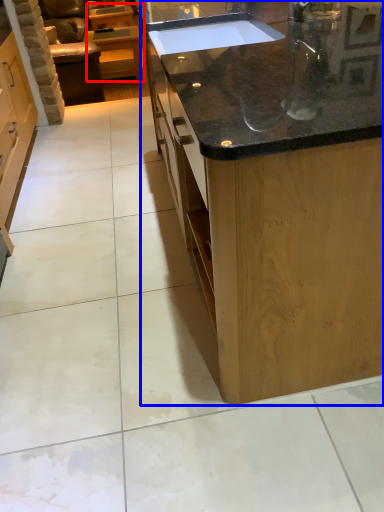
Question: Which point is further to the camera, cabinetry (highlighted by a red box) or countertop (highlighted by a blue box)?

Choices:
 (A) cabinetry
 (B) countertop

Answer: (A)